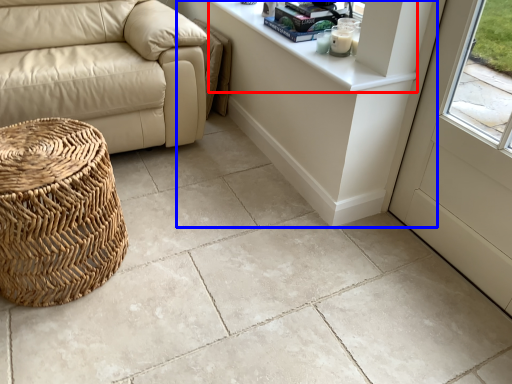
Question: Which of the following is the closest to the observer, counter top (highlighted by a red box) or table (highlighted by a blue box)?

Choices:
 (A) counter top
 (B) table

Answer: (A)